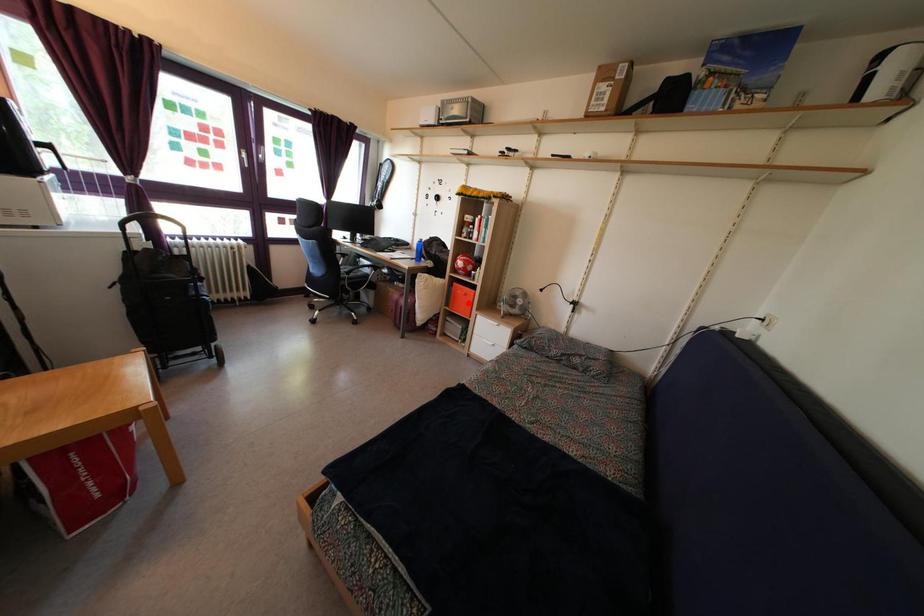
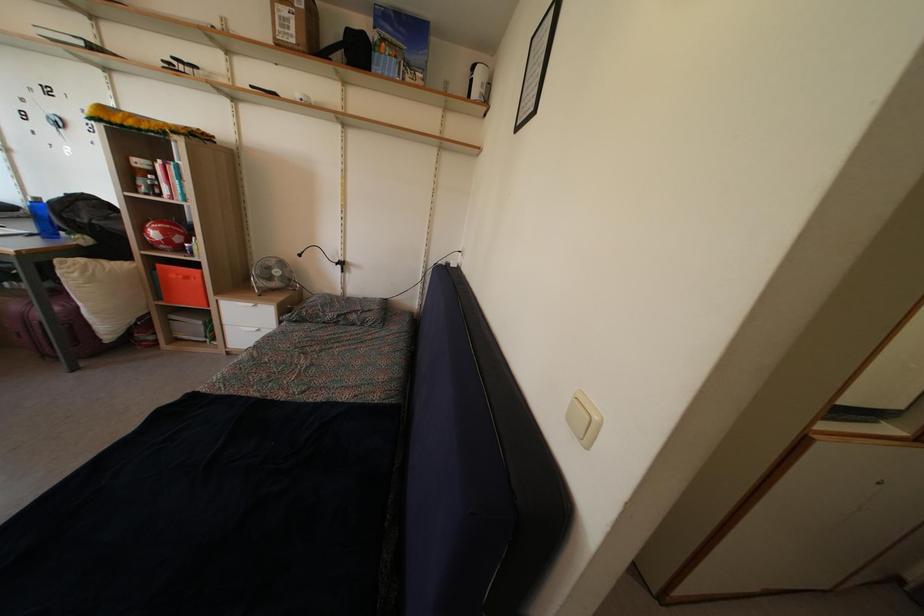
Locate, in the second image, the point that corresponds to the highlighted location in the first image.

(189, 286)